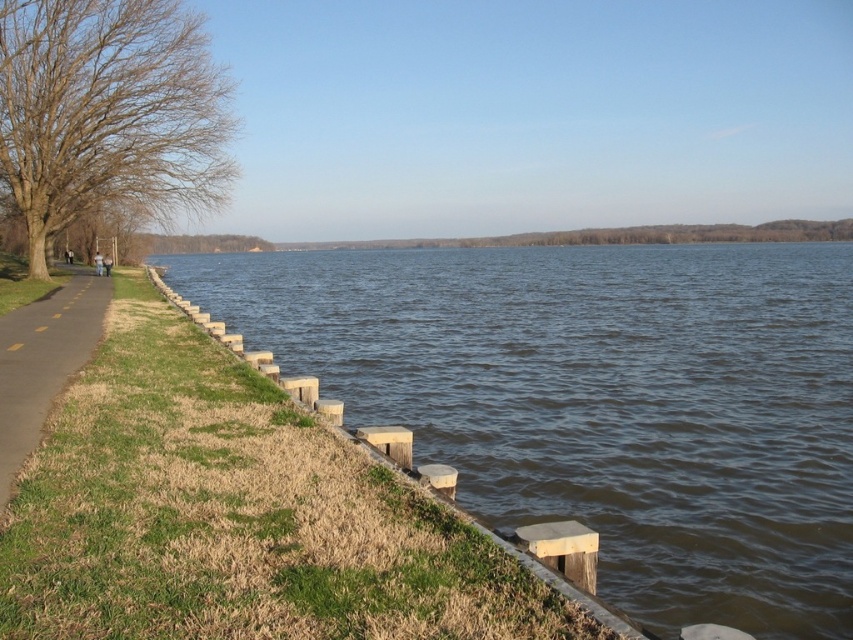
You are a gardener planning to mow the green grass at lower left and trim the brown leafless tree at left. Which task would require more time due to the size of the object?

The brown leafless tree at left requires more time to trim because it is larger than the green grass at lower left.

You are a hiker standing on the yellow painted asphalt at left and want to take a photo of the brown leafless tree at left. Will the tree be fully visible in the photo if you stand at that spot?

The brown leafless tree at left is taller than the yellow painted asphalt at left, so yes, the tree will be fully visible in the photo when you stand on the yellow painted asphalt at left.